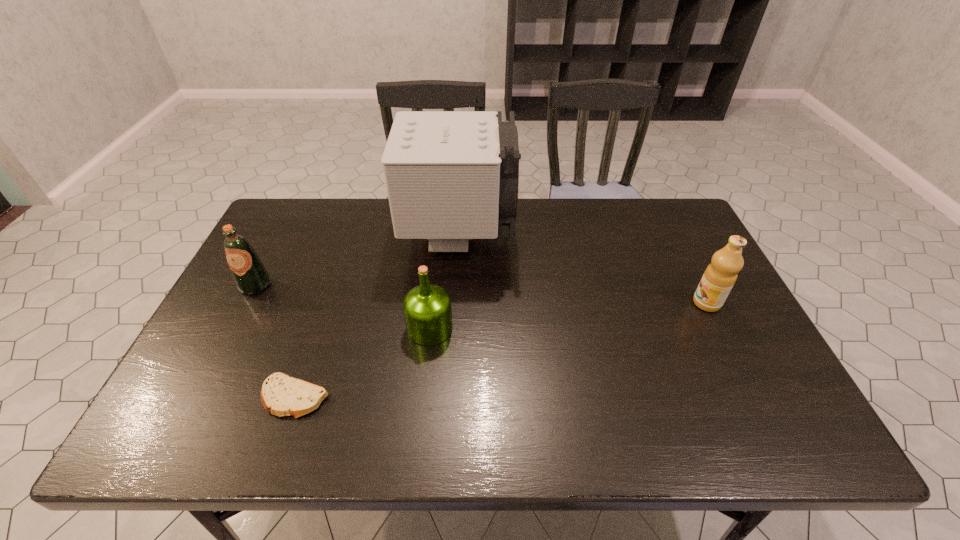
Identify the location of the tallest object. (451, 176).

Where is `the farthest object`? The image size is (960, 540). the farthest object is located at coordinates (451, 176).

I want to click on the rightmost object, so click(x=721, y=274).

Identify the location of the leftmost object. (251, 277).

Where is `the second olive oil from left to right`? the second olive oil from left to right is located at coordinates (427, 309).

I want to click on the second object from left to right, so coord(281,395).

This screenshot has width=960, height=540. I want to click on the shortest object, so coord(281,395).

You are a GUI agent. You are given a task and a screenshot of the screen. Output one action in this format:
    pyautogui.click(x=<x>, y=<y>)
    Task: Click on the free location located 0.180m on the left of the farthest object
    The width and height of the screenshot is (960, 540).
    Given the screenshot: What is the action you would take?
    pyautogui.click(x=348, y=237)

At what (x,y) coordinates should I click in order to perform the action: click on vacant space located on the label of the rightmost olive oil. Please return your answer as a coordinate pair (x, y). Looking at the image, I should click on (675, 303).

Find the location of a particular element. The height and width of the screenshot is (540, 960). vacant space located 0.180m on the label of the rightmost olive oil is located at coordinates (627, 303).